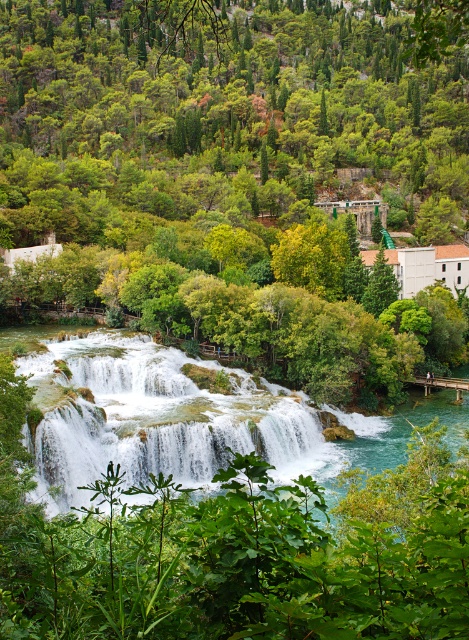
Based on the photo, who is higher up, green leafy tree at center or white frothy water at center?

green leafy tree at center is higher up.

Measure the distance between green leafy tree at center and camera.

green leafy tree at center and camera are 17.17 meters apart.

At what (x,y) coordinates should I click in order to perform the action: click on green leafy tree at center. Please return your answer as a coordinate pair (x, y). Image resolution: width=469 pixels, height=640 pixels. Looking at the image, I should click on (241, 172).